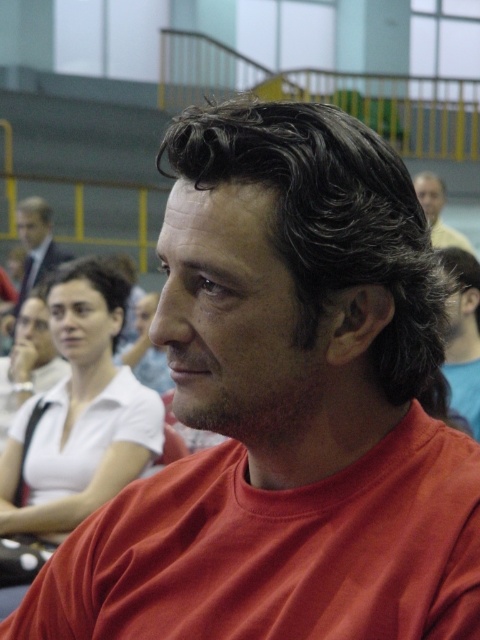
Question: Which object appears farthest from the camera in this image?

Choices:
 (A) white matte shirt at center
 (B) matte black hair at upper center
 (C) matte red shirt at center
 (D) matte black suit at upper left

Answer: (D)

Question: Is matte red shirt at center bigger than matte black suit at upper left?

Choices:
 (A) no
 (B) yes

Answer: (A)

Question: Can you confirm if matte red shirt at center is smaller than matte black hair at upper center?

Choices:
 (A) no
 (B) yes

Answer: (B)

Question: Does matte black suit at upper left appear on the right side of matte black hair at upper center?

Choices:
 (A) yes
 (B) no

Answer: (B)

Question: Estimate the real-world distances between objects in this image. Which object is farther from the matte red shirt at center?

Choices:
 (A) white matte shirt at center
 (B) matte black suit at upper left
 (C) matte black hair at upper center

Answer: (B)

Question: Which object is farther from the camera taking this photo?

Choices:
 (A) matte red shirt at center
 (B) white matte shirt at center
 (C) matte black suit at upper left

Answer: (C)